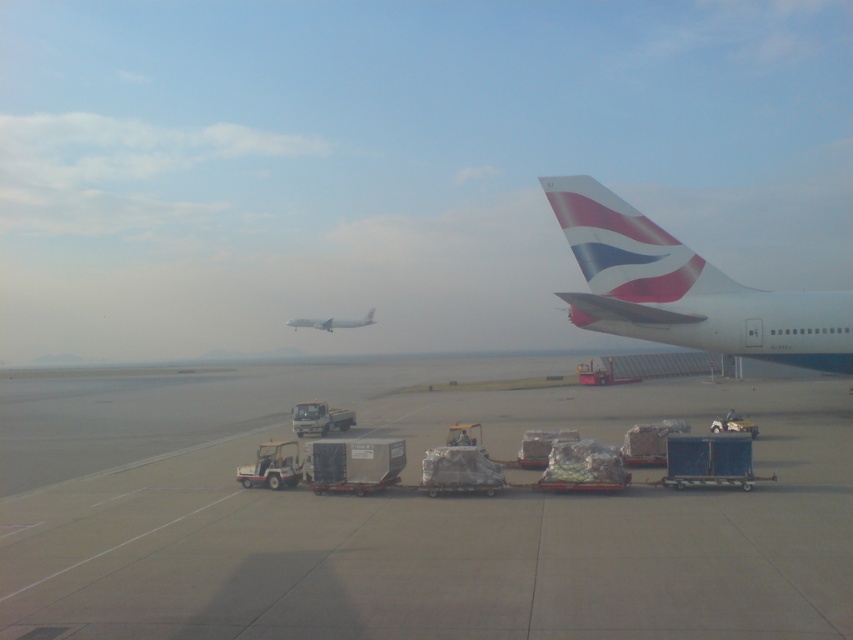
Question: Which point appears closest to the camera in this image?

Choices:
 (A) (622, 312)
 (B) (358, 323)

Answer: (A)

Question: Which of the following is the closest to the observer?

Choices:
 (A) (618, 216)
 (B) (788, 531)
 (C) (308, 321)

Answer: (B)

Question: Can you confirm if smooth concrete tarmac at center is positioned to the right of white matte airplane at center?

Choices:
 (A) no
 (B) yes

Answer: (B)

Question: Which object appears farthest from the camera in this image?

Choices:
 (A) smooth concrete tarmac at center
 (B) polished aluminum airplane at right
 (C) white matte airplane at center

Answer: (C)

Question: Can you confirm if smooth concrete tarmac at center is bigger than polished aluminum airplane at right?

Choices:
 (A) no
 (B) yes

Answer: (B)

Question: Is smooth concrete tarmac at center bigger than polished aluminum airplane at right?

Choices:
 (A) yes
 (B) no

Answer: (A)